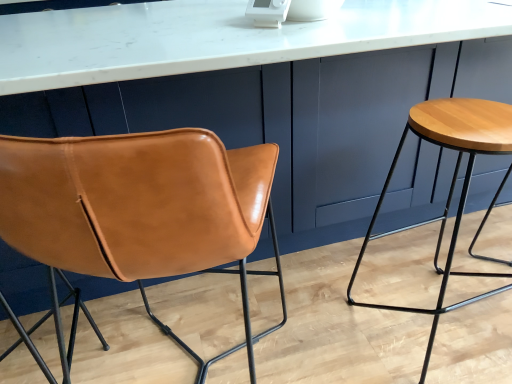
In order to face wooden stool at right, should I rotate leftwards or rightwards?

A 24.249 degree turn to the right will do.

Image resolution: width=512 pixels, height=384 pixels. What do you see at coordinates (140, 208) in the screenshot?
I see `cognac leather chair at left` at bounding box center [140, 208].

Measure the distance between white marble countertop at center and camera.

white marble countertop at center and camera are 83.45 centimeters apart.

Locate an element on the screen. The width and height of the screenshot is (512, 384). wooden stool at right is located at coordinates (451, 182).

Is wooden stool at right located outside white marble countertop at center?

Actually, wooden stool at right is at least partially inside white marble countertop at center.

At what (x,y) coordinates should I click in order to perform the action: click on stool that appears below the white marble countertop at center (from a real-world perspective). Please return your answer as a coordinate pair (x, y). This screenshot has height=384, width=512. Looking at the image, I should click on click(451, 182).

In the image, is wooden stool at right on the left side or the right side of white marble countertop at center?

wooden stool at right is positioned on white marble countertop at center's right side.

Can you tell me how much cognac leather chair at left and wooden stool at right differ in facing direction?

4.63 degrees.

Would you say cognac leather chair at left is outside wooden stool at right?

Yes, cognac leather chair at left is located beyond the bounds of wooden stool at right.

From a real-world perspective, is cognac leather chair at left below wooden stool at right?

No.

Does point (128, 135) come in front of point (506, 131)?

Yes, it is.

Is white marble countertop at center in front of cognac leather chair at left?

No, white marble countertop at center is further to the viewer.

Where is `chair that appears below the white marble countertop at center (from the image's perspective)`? The height and width of the screenshot is (384, 512). chair that appears below the white marble countertop at center (from the image's perspective) is located at coordinates (140, 208).

Who is taller, white marble countertop at center or cognac leather chair at left?

With more height is cognac leather chair at left.

From a real-world perspective, which is physically below, cognac leather chair at left or white marble countertop at center?

cognac leather chair at left is physically lower.

How distant is cognac leather chair at left from white marble countertop at center?

cognac leather chair at left and white marble countertop at center are 19.77 inches apart from each other.

Between cognac leather chair at left and white marble countertop at center, which one has larger width?

white marble countertop at center.

Is point (70, 200) more distant than point (0, 82)?

No, it is not.

Is wooden stool at right oriented towards cognac leather chair at left?

No.

From a real-world perspective, is wooden stool at right physically above cognac leather chair at left?

No, from a real-world perspective, wooden stool at right is not on top of cognac leather chair at left.

Which is more to the left, wooden stool at right or cognac leather chair at left?

Positioned to the left is cognac leather chair at left.

How distant is wooden stool at right from cognac leather chair at left?

wooden stool at right is 38.35 inches from cognac leather chair at left.

Considering the relative sizes of white marble countertop at center and wooden stool at right in the image provided, is white marble countertop at center shorter than wooden stool at right?

In fact, white marble countertop at center may be taller than wooden stool at right.

Who is smaller, white marble countertop at center or wooden stool at right?

wooden stool at right is smaller.

From a real-world perspective, is white marble countertop at center beneath wooden stool at right?

Incorrect, from a real-world perspective, white marble countertop at center is higher than wooden stool at right.

Does point (219, 7) come farther from viewer compared to point (478, 235)?

No, it is in front of (478, 235).

At what (x,y) coordinates should I click in order to perform the action: click on stool behind the white marble countertop at center. Please return your answer as a coordinate pair (x, y). Looking at the image, I should click on (451, 182).

Where is `stool lying on the right of cognac leather chair at left`? stool lying on the right of cognac leather chair at left is located at coordinates (451, 182).

Looking at the image, which one is located further to cognac leather chair at left, wooden stool at right or white marble countertop at center?

Based on the image, wooden stool at right appears to be further to cognac leather chair at left.

Estimate the real-world distances between objects in this image. Which object is closer to cognac leather chair at left, white marble countertop at center or wooden stool at right?

white marble countertop at center is closer to cognac leather chair at left.

Considering their positions, is wooden stool at right positioned further to white marble countertop at center than cognac leather chair at left?

The object further to white marble countertop at center is wooden stool at right.

Based on their spatial positions, is white marble countertop at center or cognac leather chair at left further from wooden stool at right?

cognac leather chair at left lies further to wooden stool at right than the other object.

In the scene shown: From the image, which object appears to be farther from white marble countertop at center, cognac leather chair at left or wooden stool at right?

wooden stool at right is further to white marble countertop at center.

Which object lies nearer to the anchor point wooden stool at right, cognac leather chair at left or white marble countertop at center?

The object closer to wooden stool at right is white marble countertop at center.

Locate an element on the screen. This screenshot has height=384, width=512. counter situated between cognac leather chair at left and wooden stool at right from left to right is located at coordinates (216, 38).